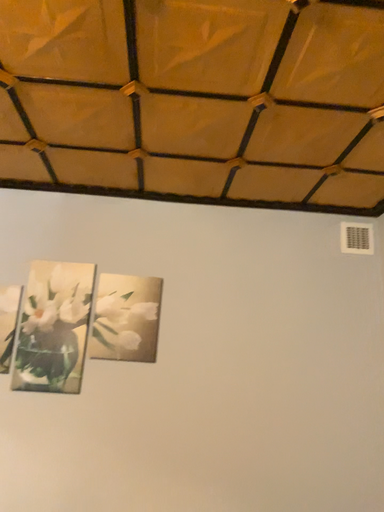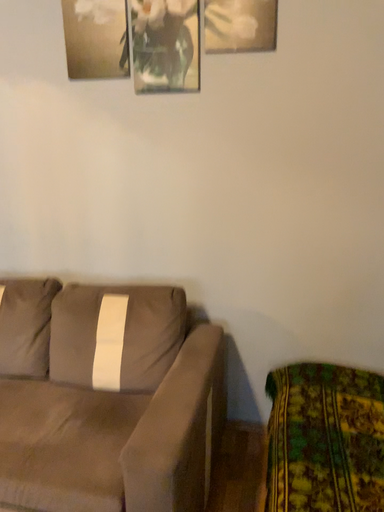
Question: How did the camera likely rotate when shooting the video?

Choices:
 (A) rotated downward
 (B) rotated upward

Answer: (A)